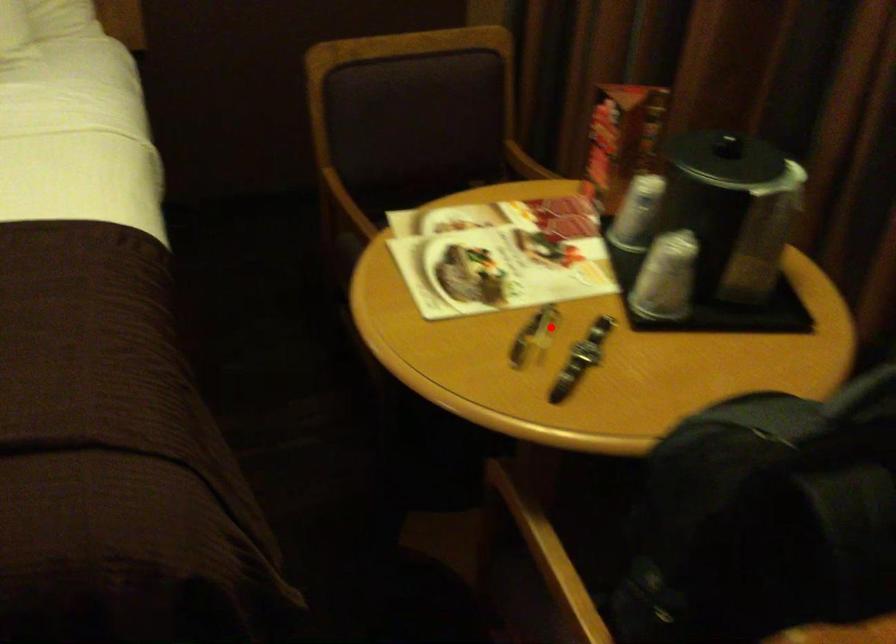
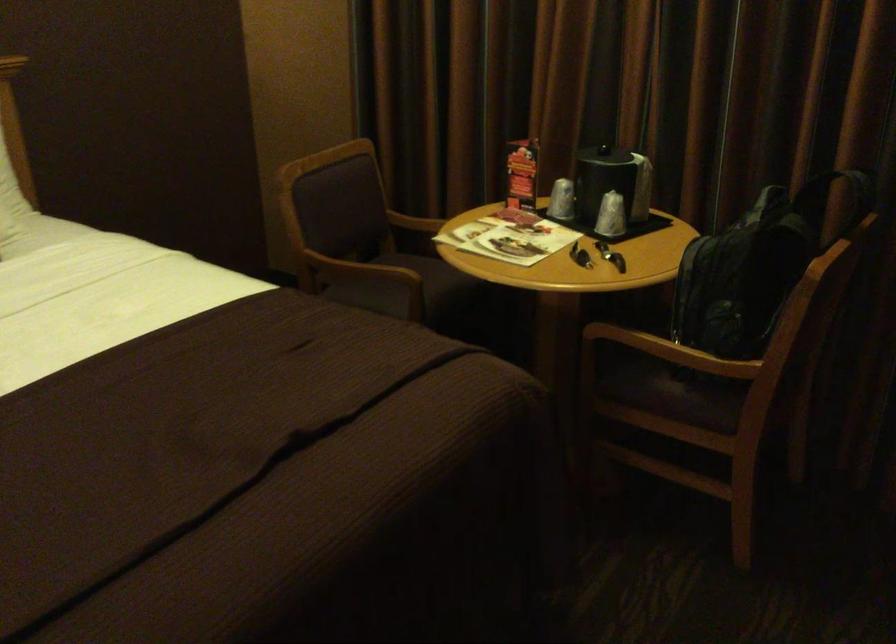
Find the pixel in the second image that matches the highlighted location in the first image.

(580, 254)